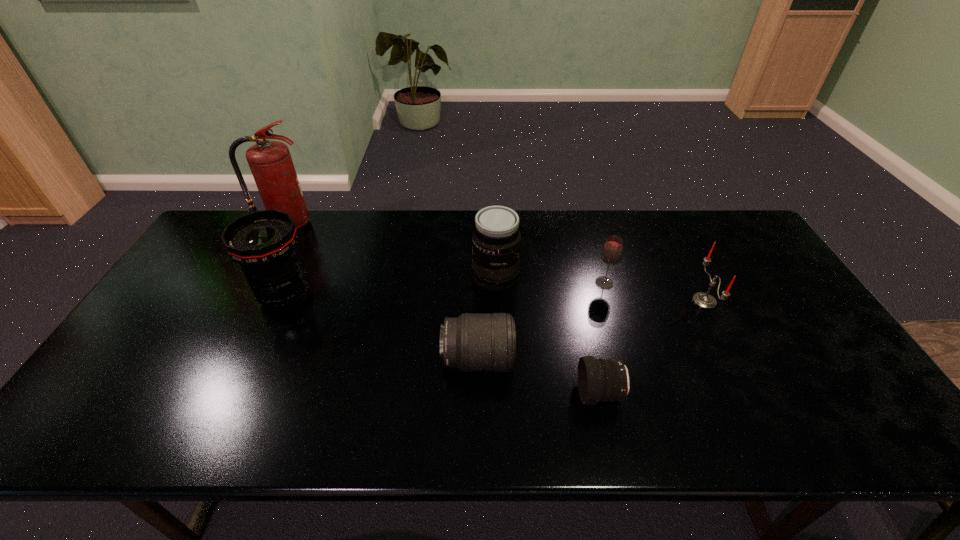
This screenshot has width=960, height=540. Identify the location of unoccupied area between the glass drink container and the second shortest telephoto lens. (540, 321).

Identify which object is the nearest to the second object from right to left. Please provide its 2D coordinates. Your answer should be formatted as a tuple, i.e. [(x, y)], where the tuple contains the x and y coordinates of a point satisfying the conditions above.

[(704, 300)]

Locate an element on the screen. The width and height of the screenshot is (960, 540). the second closest object to the sixth object from left to right is located at coordinates (496, 241).

Locate which telephoto lens is the second closest to the third tallest telephoto lens. Please provide its 2D coordinates. Your answer should be formatted as a tuple, i.e. [(x, y)], where the tuple contains the x and y coordinates of a point satisfying the conditions above.

[(496, 241)]

The width and height of the screenshot is (960, 540). I want to click on telephoto lens that is the nearest to the third tallest telephoto lens, so click(603, 380).